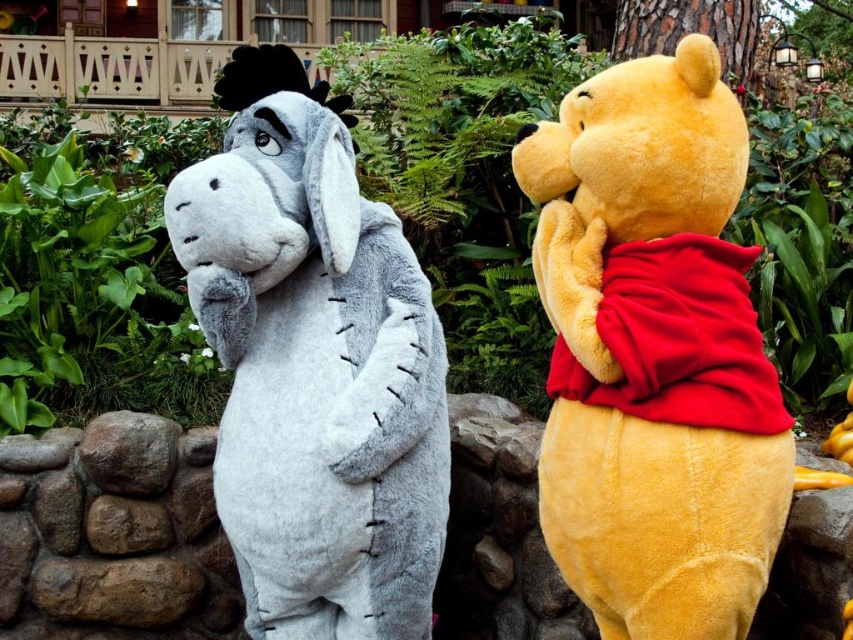
Is soft yellow teddy bear at center bigger than fuzzy gray donkey at left?

No.

Which is below, soft yellow teddy bear at center or fuzzy gray donkey at left?

Positioned lower is fuzzy gray donkey at left.

Who is more forward, (634, 321) or (430, 300)?

Point (634, 321)

I want to click on soft yellow teddy bear at center, so click(654, 353).